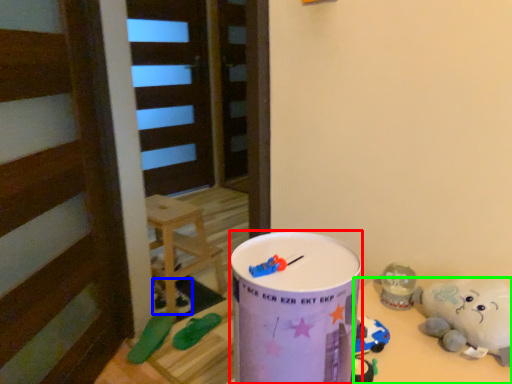
Question: Which is nearer to the milk can (highlighted by a red box)? toy (highlighted by a blue box) or table (highlighted by a green box).

Choices:
 (A) toy
 (B) table

Answer: (B)